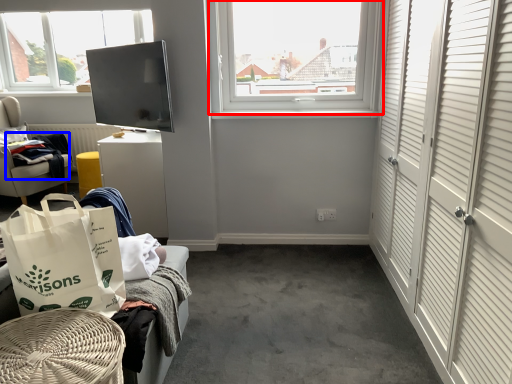
Question: Which point is further to the camera, window (highlighted by a red box) or clothing (highlighted by a blue box)?

Choices:
 (A) window
 (B) clothing

Answer: (B)